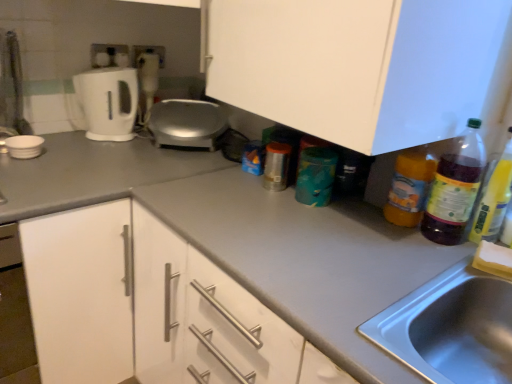
The height and width of the screenshot is (384, 512). Identify the location of free spot in front of white plastic blender at upper left. (130, 135).